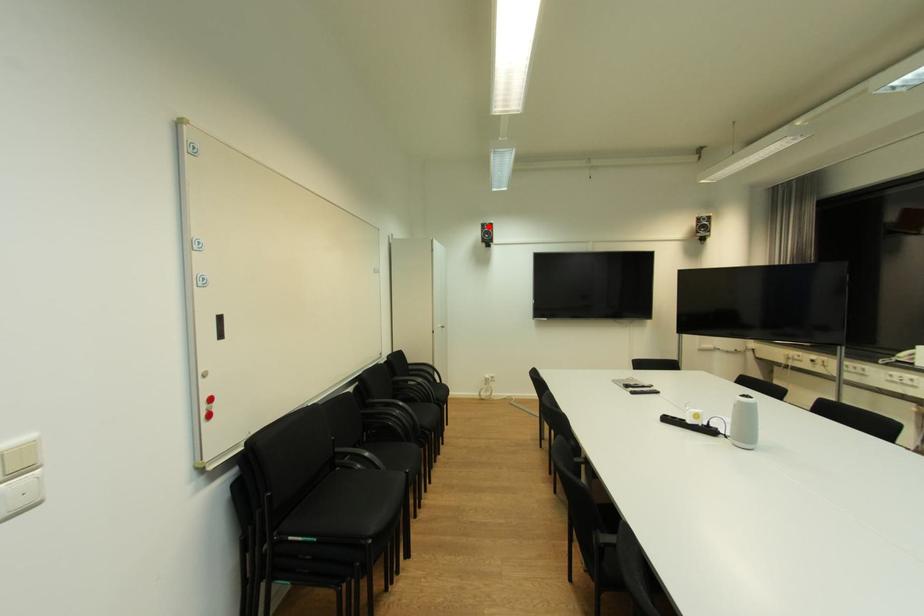
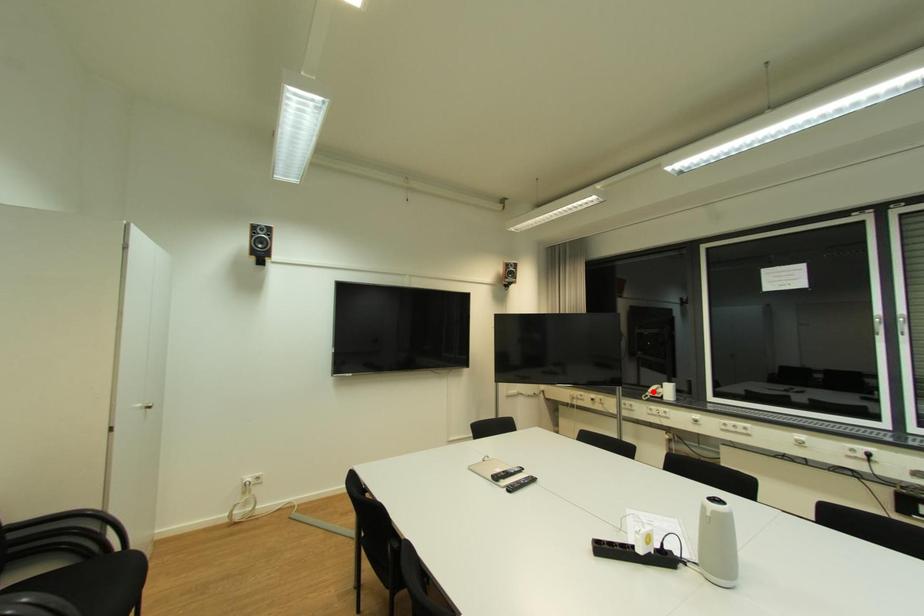
I am providing you with two images of the same scene from different viewpoints. A red point is marked on the first image and another point is marked on the second image. Are the points marked in image1 and image2 representing the same 3D position?

No